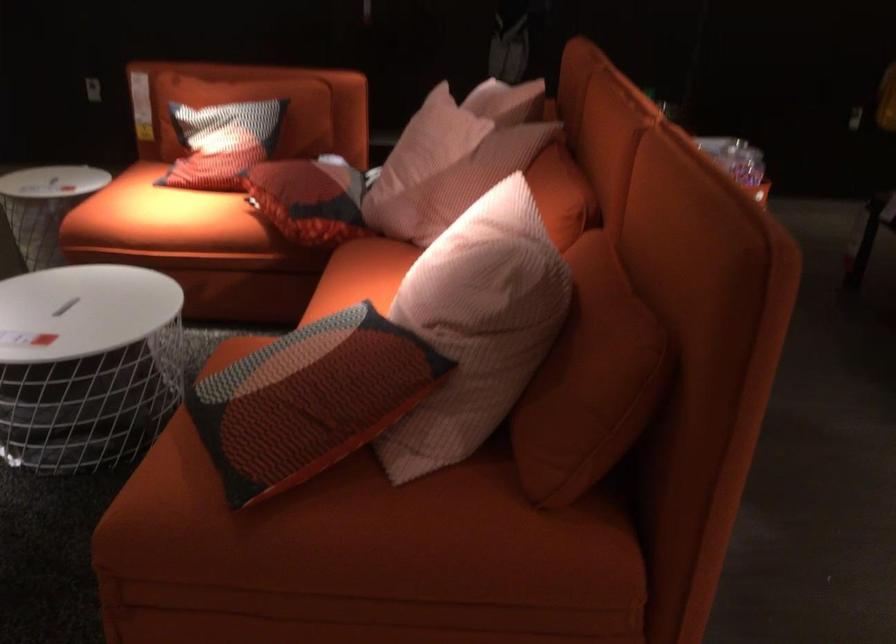
Identify the location of pink striped pillow. (309, 400).